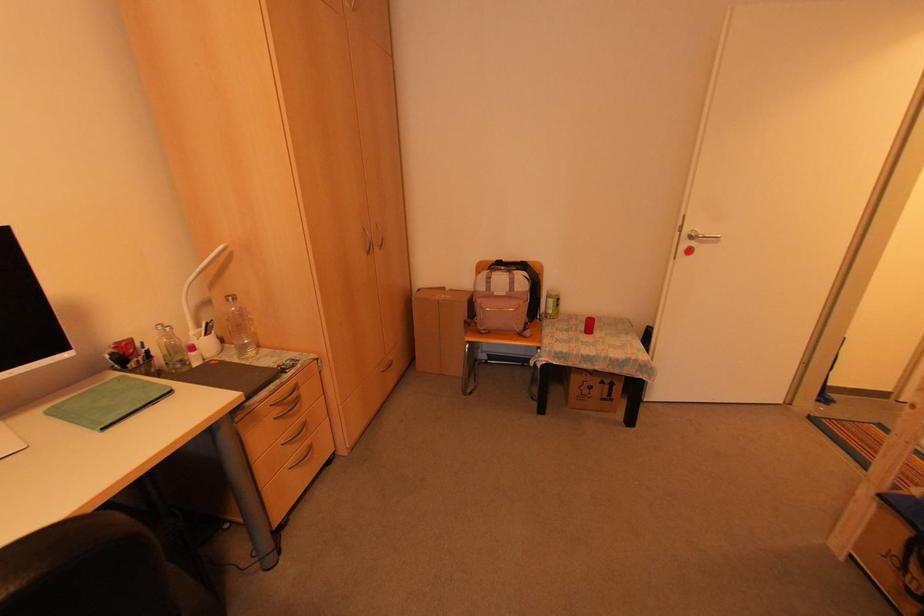
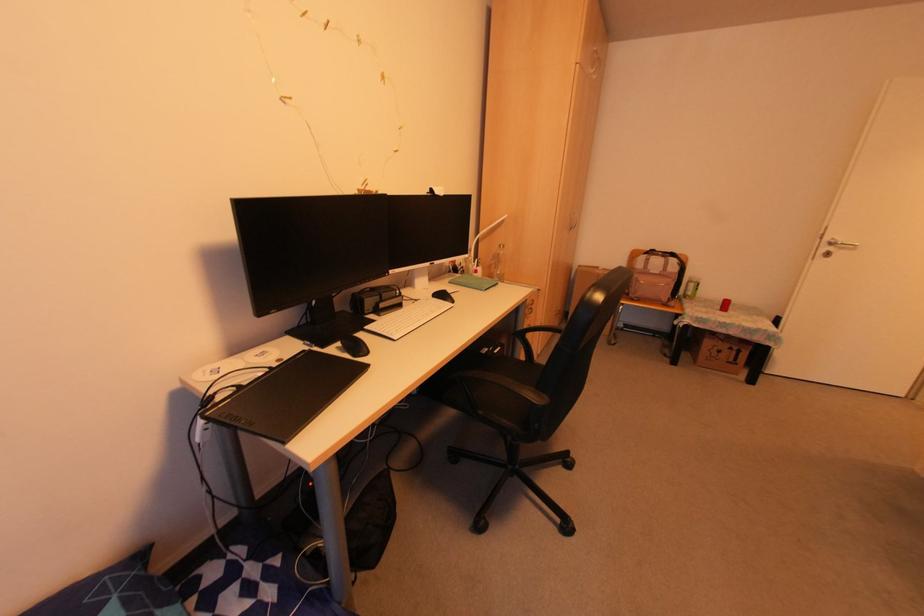
Question: I am providing you with two images of the same scene from different viewpoints. Given a red point in image1, look at the same physical point in image2. Is it:

Choices:
 (A) Closer to the viewpoint
 (B) Farther from the viewpoint

Answer: (B)